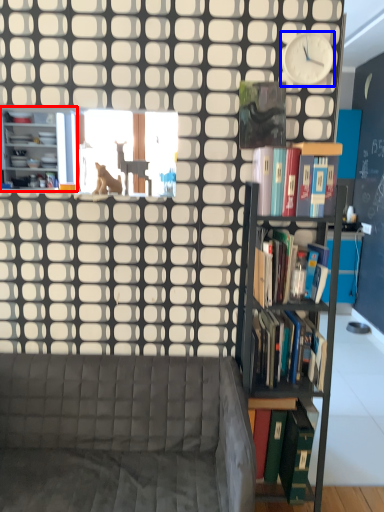
Question: Which object is closer to the camera taking this photo, bookcase (highlighted by a red box) or clock (highlighted by a blue box)?

Choices:
 (A) bookcase
 (B) clock

Answer: (B)